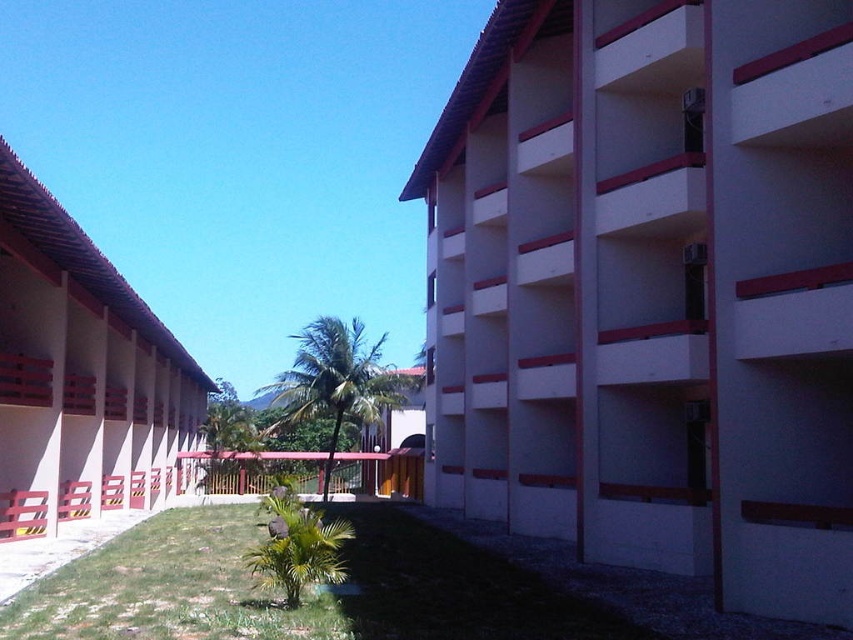
Does white smooth building at center appear on the left side of beige concrete building at left?

Incorrect, white smooth building at center is not on the left side of beige concrete building at left.

What do you see at coordinates (650, 289) in the screenshot? I see `white smooth building at center` at bounding box center [650, 289].

Identify the location of white smooth building at center. The width and height of the screenshot is (853, 640). (650, 289).